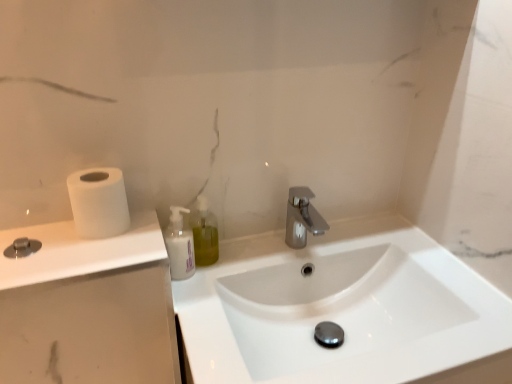
Locate an element on the screen. free spot in front of white matte toilet paper at left is located at coordinates (75, 254).